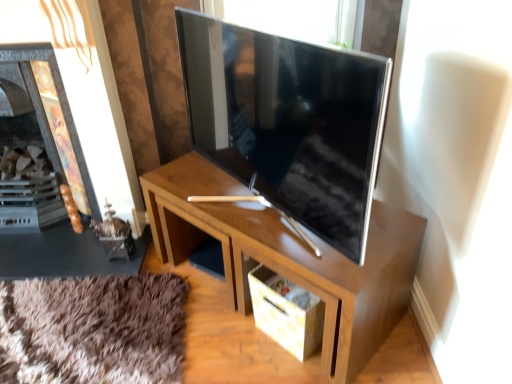
Question: Does satin silver tv at center have a greater width compared to wooden desk at center?

Choices:
 (A) yes
 (B) no

Answer: (B)

Question: Can you confirm if satin silver tv at center is positioned to the right of wooden desk at center?

Choices:
 (A) no
 (B) yes

Answer: (A)

Question: Can you confirm if satin silver tv at center is thinner than wooden desk at center?

Choices:
 (A) yes
 (B) no

Answer: (A)

Question: From a real-world perspective, is satin silver tv at center under wooden desk at center?

Choices:
 (A) no
 (B) yes

Answer: (A)

Question: Is satin silver tv at center oriented towards wooden desk at center?

Choices:
 (A) no
 (B) yes

Answer: (A)

Question: Does satin silver tv at center have a lesser height compared to wooden desk at center?

Choices:
 (A) yes
 (B) no

Answer: (B)

Question: Is wooden fireplace at left surrounded by wooden desk at center?

Choices:
 (A) yes
 (B) no

Answer: (B)

Question: Is wooden desk at center further to the viewer compared to wooden fireplace at left?

Choices:
 (A) yes
 (B) no

Answer: (B)

Question: From a real-world perspective, is wooden desk at center physically below wooden fireplace at left?

Choices:
 (A) no
 (B) yes

Answer: (B)

Question: Is wooden desk at center positioned in front of wooden fireplace at left?

Choices:
 (A) yes
 (B) no

Answer: (A)

Question: From the image's perspective, is wooden desk at center under wooden fireplace at left?

Choices:
 (A) no
 (B) yes

Answer: (B)

Question: Can you confirm if wooden desk at center is wider than wooden fireplace at left?

Choices:
 (A) yes
 (B) no

Answer: (A)

Question: Is wooden fireplace at left turned away from satin silver tv at center?

Choices:
 (A) no
 (B) yes

Answer: (A)